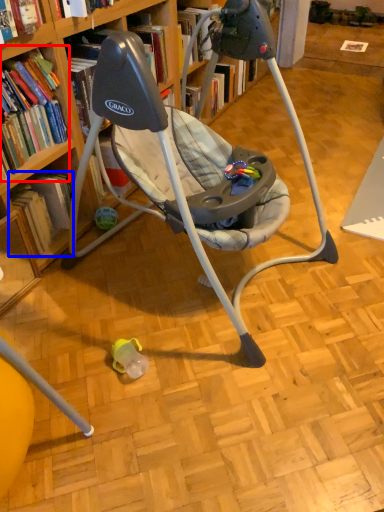
Question: Which of the following is the closest to the observer, book (highlighted by a red box) or book (highlighted by a blue box)?

Choices:
 (A) book
 (B) book

Answer: (A)